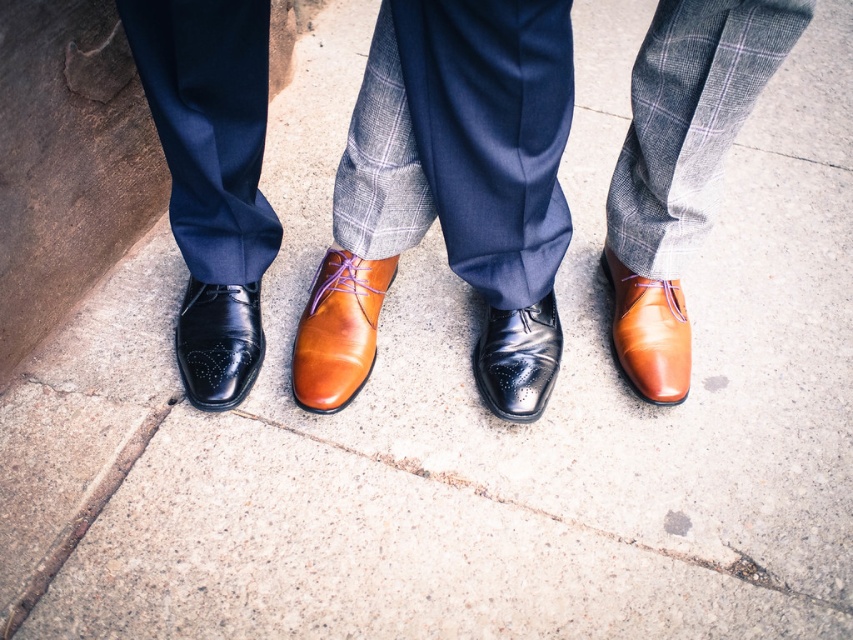
Is black leather shoe at lower left positioned before cognac leather shoe at center?

Yes, black leather shoe at lower left is in front of cognac leather shoe at center.

Can you confirm if black leather shoe at lower left is positioned above cognac leather shoe at center?

Actually, black leather shoe at lower left is below cognac leather shoe at center.

Is point (216, 316) positioned behind point (680, 296)?

No, it is in front of (680, 296).

What are the coordinates of `black leather shoe at lower left` in the screenshot? It's located at (218, 342).

Who is more forward, (654, 300) or (535, 365)?

Point (535, 365) is more forward.

Locate an element on the screen. This screenshot has width=853, height=640. cognac leather shoe at center is located at coordinates (648, 332).

Between shiny brown leather shoe at center and black leather shoe at lower left, which one has less height?

black leather shoe at lower left is shorter.

Identify the location of shiny brown leather shoe at center. (338, 330).

Where is `shiny brown leather shoe at center`? shiny brown leather shoe at center is located at coordinates (338, 330).